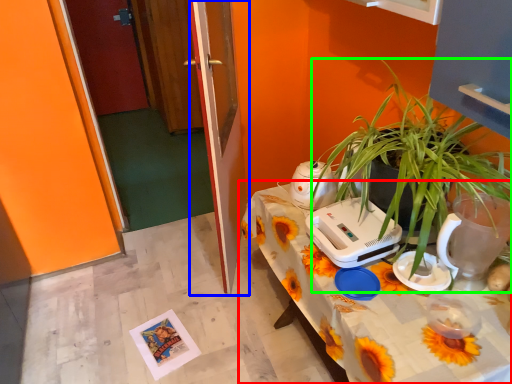
Question: Which object is the farthest from table (highlighted by a red box)? Choose among these: glass door (highlighted by a blue box) or houseplant (highlighted by a green box).

Choices:
 (A) glass door
 (B) houseplant

Answer: (A)